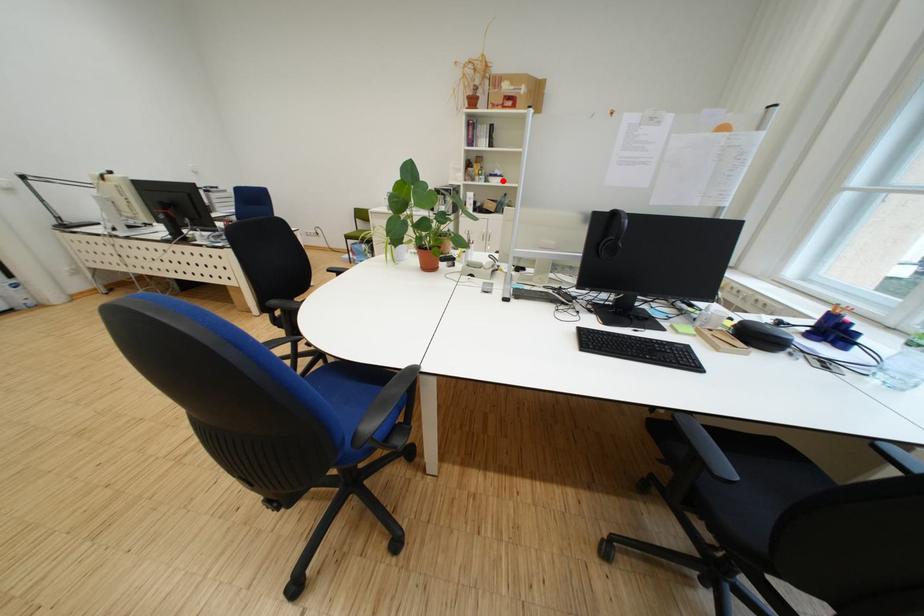
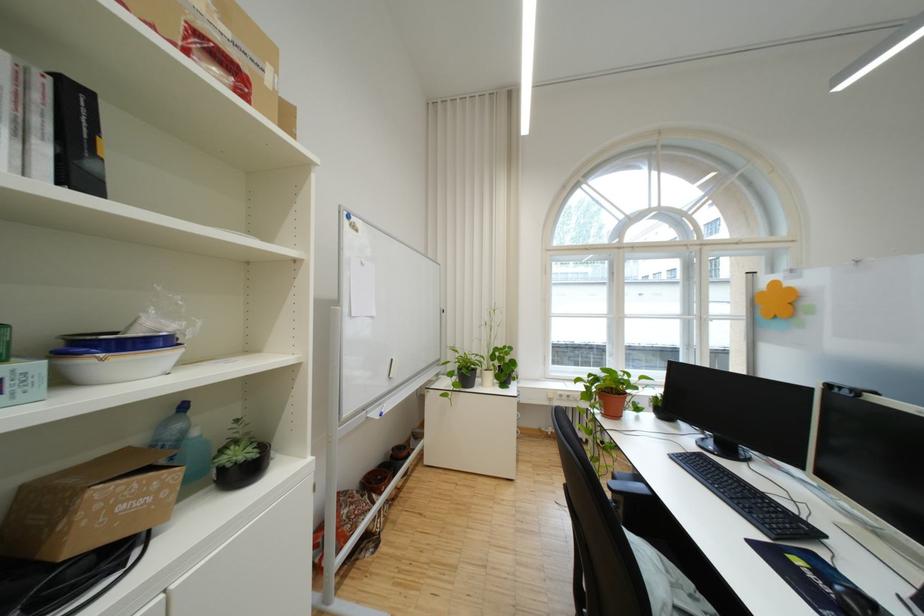
Question: I am providing you with two images of the same scene from different viewpoints. A red point is shown in image1. For the corresponding object point in image2, is it positioned nearer or farther from the camera?

Choices:
 (A) Nearer
 (B) Farther

Answer: (B)